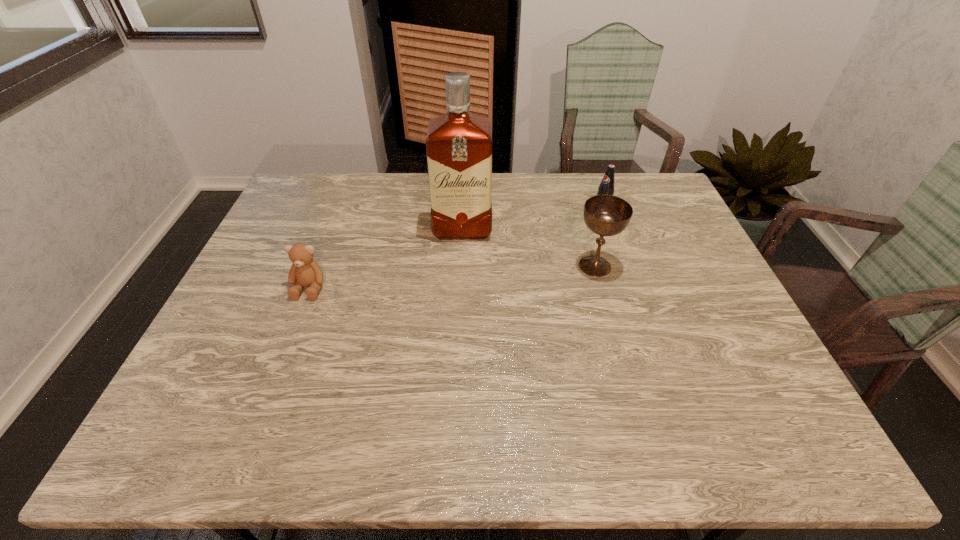
Where is `blank space located on the front label of the second shortest object`? This screenshot has height=540, width=960. blank space located on the front label of the second shortest object is located at coordinates coord(578,225).

Find the location of a particular element. free space located 0.280m on the front label of the second shortest object is located at coordinates (529, 250).

The image size is (960, 540). Identify the location of free spot located on the front label of the liquor. point(463,283).

Identify the location of vacant position located on the front label of the liquor. (463, 280).

You are a GUI agent. You are given a task and a screenshot of the screen. Output one action in this format:
    pyautogui.click(x=<x>, y=<y>)
    Task: Click on the vacant area situated 0.240m on the front label of the liquor
    This screenshot has height=540, width=960.
    Given the screenshot: What is the action you would take?
    pyautogui.click(x=462, y=302)

You are a GUI agent. You are given a task and a screenshot of the screen. Output one action in this format:
    pyautogui.click(x=<x>, y=<y>)
    Task: Click on the object present at the far edge
    The image size is (960, 540).
    Given the screenshot: What is the action you would take?
    pyautogui.click(x=606, y=187)

Find the location of `object present at the left edge`. object present at the left edge is located at coordinates (305, 272).

I want to click on free space at the far edge of the desktop, so click(528, 197).

Where is `free space at the near edge`? free space at the near edge is located at coordinates (546, 395).

In the image, there is a desktop. Where is `vacant space at the left edge`? Image resolution: width=960 pixels, height=540 pixels. vacant space at the left edge is located at coordinates pyautogui.click(x=270, y=320).